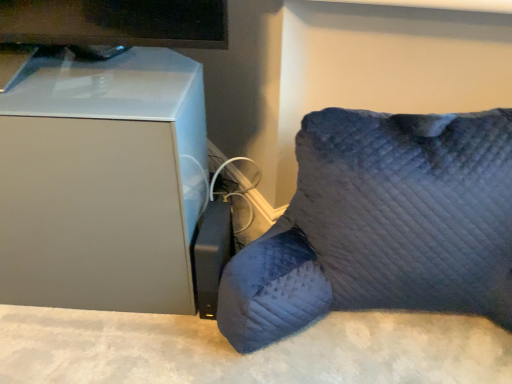
Question: Does dark blue quilted pillow at lower right, which is the 1th furniture in right-to-left order, have a greater height compared to white matte mini fridge at left, acting as the 1th furniture starting from the left?

Choices:
 (A) yes
 (B) no

Answer: (B)

Question: Considering the relative sizes of dark blue quilted pillow at lower right, which is the 1th furniture in right-to-left order, and white matte mini fridge at left, the 2th furniture when ordered from right to left, in the image provided, is dark blue quilted pillow at lower right, which is the 1th furniture in right-to-left order, wider than white matte mini fridge at left, the 2th furniture when ordered from right to left,?

Choices:
 (A) no
 (B) yes

Answer: (B)

Question: Is dark blue quilted pillow at lower right, which is the 1th furniture in right-to-left order, positioned far away from white matte mini fridge at left, acting as the 1th furniture starting from the left?

Choices:
 (A) no
 (B) yes

Answer: (A)

Question: Is dark blue quilted pillow at lower right, which is the 1th furniture in right-to-left order, further to camera compared to white matte mini fridge at left, the 2th furniture when ordered from right to left?

Choices:
 (A) yes
 (B) no

Answer: (B)

Question: Does dark blue quilted pillow at lower right, arranged as the 2th furniture when viewed from the left, have a lesser height compared to white matte mini fridge at left, the 2th furniture when ordered from right to left?

Choices:
 (A) no
 (B) yes

Answer: (B)

Question: Does dark blue quilted pillow at lower right, arranged as the 2th furniture when viewed from the left, have a smaller size compared to white matte mini fridge at left, the 2th furniture when ordered from right to left?

Choices:
 (A) yes
 (B) no

Answer: (B)

Question: Is dark blue quilted pillow at lower right, which is the 1th furniture in right-to-left order, inside white matte mini fridge at left, the 2th furniture when ordered from right to left?

Choices:
 (A) no
 (B) yes

Answer: (A)

Question: Does white matte mini fridge at left, acting as the 1th furniture starting from the left, have a lesser width compared to dark blue quilted pillow at lower right, which is the 1th furniture in right-to-left order?

Choices:
 (A) yes
 (B) no

Answer: (A)

Question: Considering the relative sizes of white matte mini fridge at left, acting as the 1th furniture starting from the left, and dark blue quilted pillow at lower right, arranged as the 2th furniture when viewed from the left, in the image provided, is white matte mini fridge at left, acting as the 1th furniture starting from the left, wider than dark blue quilted pillow at lower right, arranged as the 2th furniture when viewed from the left,?

Choices:
 (A) no
 (B) yes

Answer: (A)

Question: Considering the relative positions of white matte mini fridge at left, acting as the 1th furniture starting from the left, and dark blue quilted pillow at lower right, which is the 1th furniture in right-to-left order, in the image provided, is white matte mini fridge at left, acting as the 1th furniture starting from the left, to the right of dark blue quilted pillow at lower right, which is the 1th furniture in right-to-left order, from the viewer's perspective?

Choices:
 (A) yes
 (B) no

Answer: (B)

Question: Is white matte mini fridge at left, the 2th furniture when ordered from right to left, taller than dark blue quilted pillow at lower right, arranged as the 2th furniture when viewed from the left?

Choices:
 (A) no
 (B) yes

Answer: (B)

Question: Does white matte mini fridge at left, the 2th furniture when ordered from right to left, have a smaller size compared to dark blue quilted pillow at lower right, which is the 1th furniture in right-to-left order?

Choices:
 (A) yes
 (B) no

Answer: (A)

Question: Considering their positions, is dark blue quilted pillow at lower right, arranged as the 2th furniture when viewed from the left, located in front of or behind white matte mini fridge at left, acting as the 1th furniture starting from the left?

Choices:
 (A) behind
 (B) front

Answer: (B)